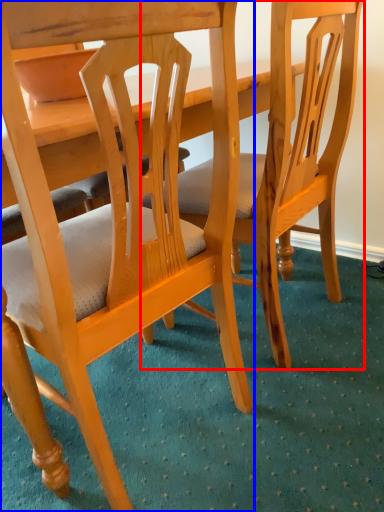
Question: Which of the following is the farthest to the observer, chair (highlighted by a red box) or chair (highlighted by a blue box)?

Choices:
 (A) chair
 (B) chair

Answer: (A)